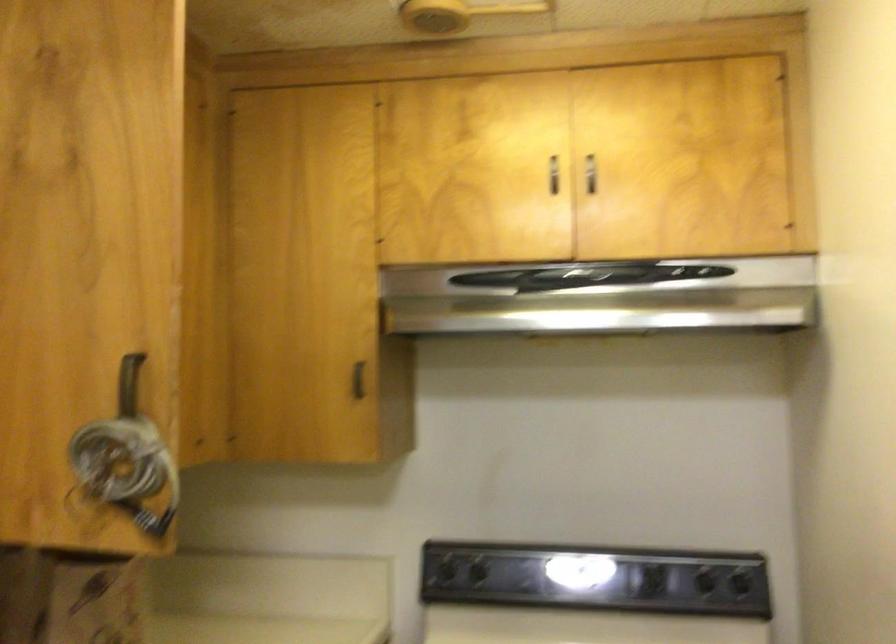
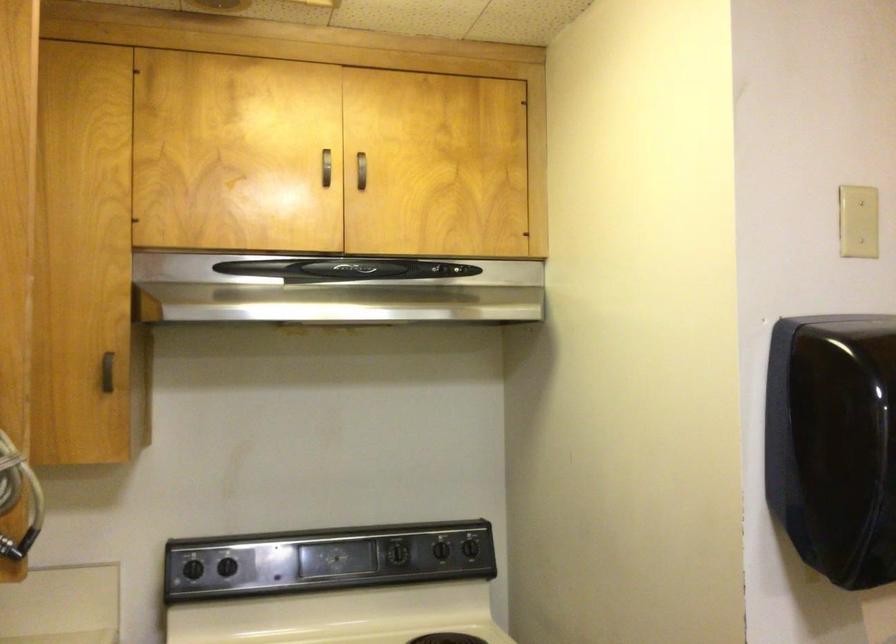
Locate, in the second image, the point that corresponds to (476,576) in the first image.

(227, 567)